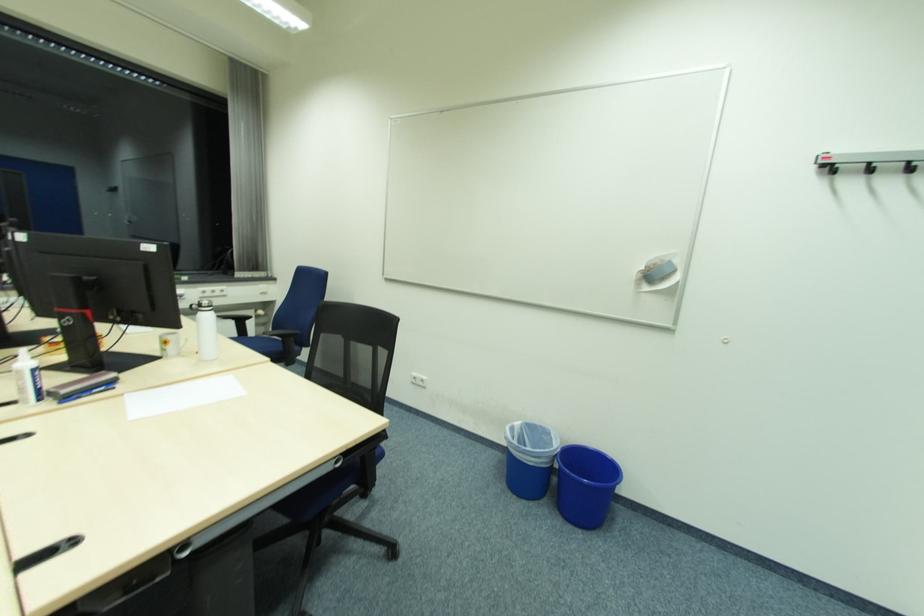
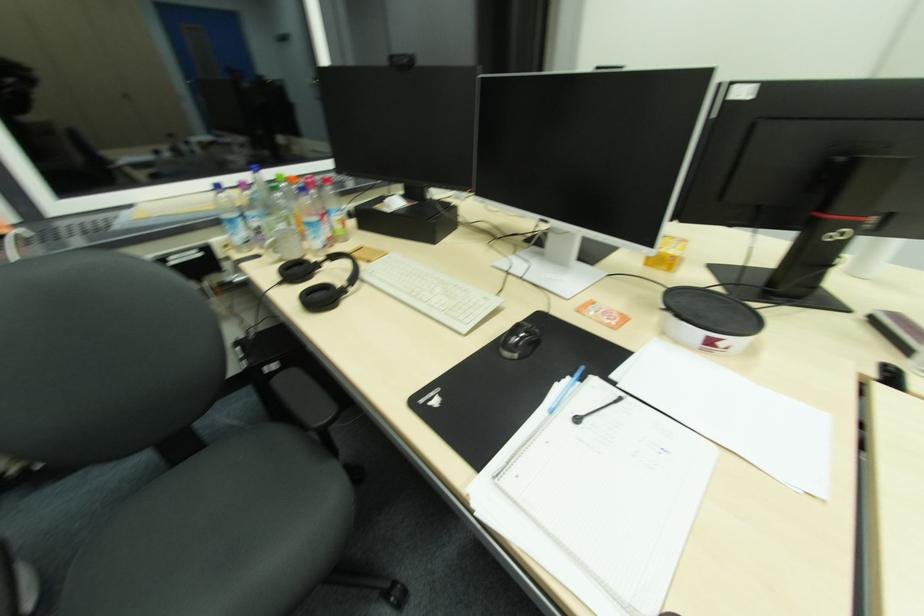
Question: The images are taken continuously from a first-person perspective. In which direction are you moving?

Choices:
 (A) Left
 (B) Right
 (C) Forward
 (D) Backward

Answer: (A)